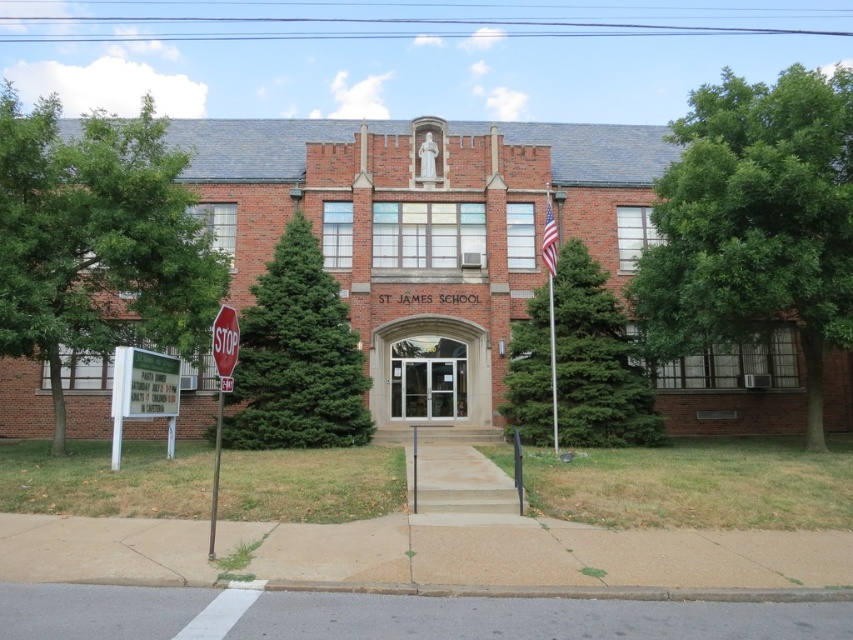
Which is behind, point (640, 442) or point (230, 336)?

Point (640, 442)

Who is more forward, (529, 305) or (230, 360)?

Point (230, 360) is in front.

The width and height of the screenshot is (853, 640). Describe the element at coordinates (596, 362) in the screenshot. I see `green coniferous tree at center` at that location.

I want to click on green coniferous tree at center, so click(596, 362).

Is green leafy tree at left taller than red matte stop sign at left?

Yes.

Who is positioned more to the left, green leafy tree at left or red matte stop sign at left?

From the viewer's perspective, green leafy tree at left appears more on the left side.

Is point (183, 198) more distant than point (230, 308)?

Yes.

Where is `green leafy tree at left`? green leafy tree at left is located at coordinates (97, 241).

Who is more forward, [119,381] or [212,502]?

Point [212,502] is more forward.

Looking at this image, who is higher up, white plastic sign at lower left or metallic pole at lower left?

white plastic sign at lower left is higher up.

Where is `white plastic sign at lower left`? white plastic sign at lower left is located at coordinates (143, 392).

Image resolution: width=853 pixels, height=640 pixels. In order to click on white plastic sign at lower left in this screenshot , I will do `click(143, 392)`.